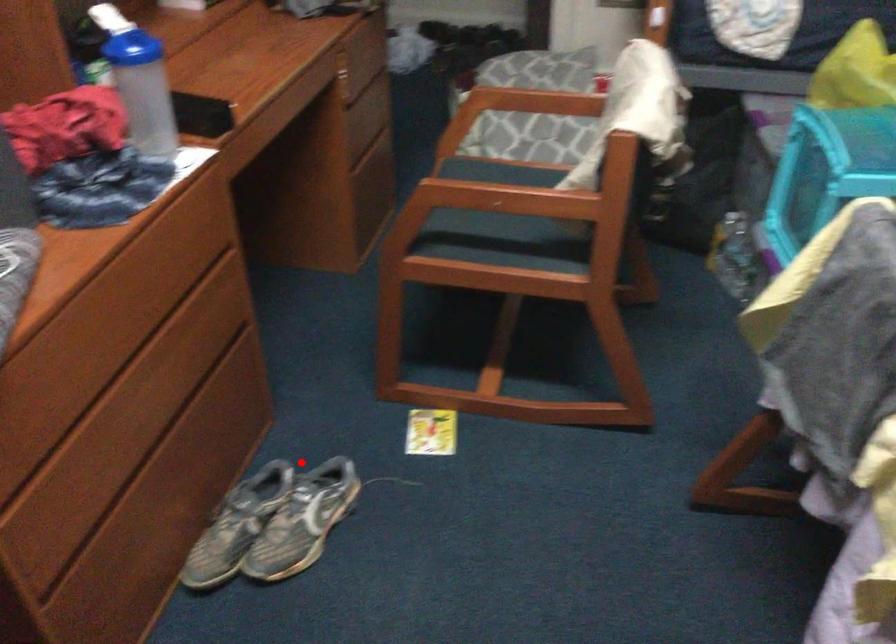
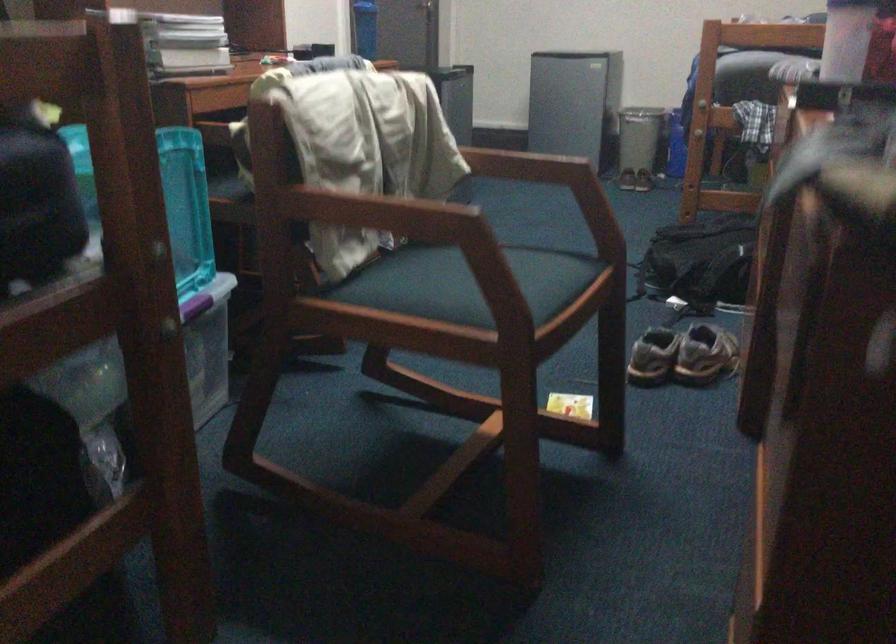
Question: I am providing you with two images of the same scene from different viewpoints. Given a red point in image1, look at the same physical point in image2. Is it:

Choices:
 (A) Closer to the viewpoint
 (B) Farther from the viewpoint

Answer: (B)